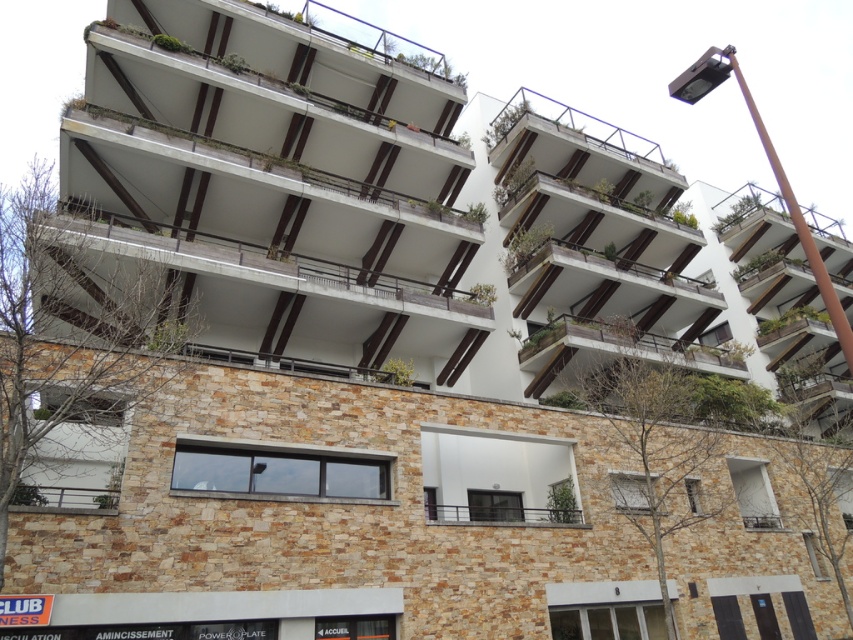
You are standing in front of the modern multi story building. You see the white concrete balcony at center and the green wooden balcony at upper center. Which balcony is closer to you?

The white concrete balcony at center is closer to the viewer than the green wooden balcony at upper center.

You are standing at the entrance of the building and looking up. There is a point marked at coordinates [608,349]. Which part of the building does this point belong to?

The point at coordinates [608,349] is on the white wooden balcony at center.

You are standing at the entrance of the multi story building and looking up. There is a point marked at coordinates (599, 284). What is located at that point?

At point (599, 284) lies white concrete balcony at center.